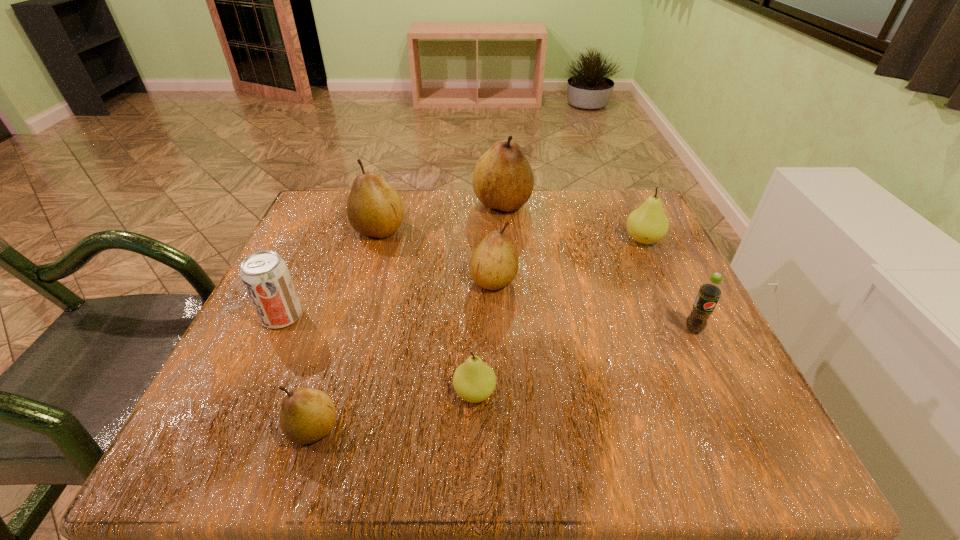
Find the location of a particular element. empty location between the tallest pear and the right green pear is located at coordinates (572, 222).

Where is `unoccupied position between the right soda and the left green pear`? Image resolution: width=960 pixels, height=540 pixels. unoccupied position between the right soda and the left green pear is located at coordinates (584, 361).

What are the coordinates of `vacant space in between the nearest brown pear and the second nearest brown pear` in the screenshot? It's located at (403, 354).

Image resolution: width=960 pixels, height=540 pixels. I want to click on the seventh closest object relative to the rightmost pear, so click(x=265, y=275).

Locate which object is the closest to the tallest object. Please provide its 2D coordinates. Your answer should be formatted as a tuple, i.e. [(x, y)], where the tuple contains the x and y coordinates of a point satisfying the conditions above.

[(374, 209)]

You are a GUI agent. You are given a task and a screenshot of the screen. Output one action in this format:
    pyautogui.click(x=<x>, y=<y>)
    Task: Click on the pear that is the second nearest to the left soda
    This screenshot has width=960, height=540.
    Given the screenshot: What is the action you would take?
    pyautogui.click(x=374, y=209)

Select which pear is the third closest to the left soda. Please provide its 2D coordinates. Your answer should be formatted as a tuple, i.e. [(x, y)], where the tuple contains the x and y coordinates of a point satisfying the conditions above.

[(474, 381)]

Find the location of `the fourth closest brown pear to the bigger green pear`. the fourth closest brown pear to the bigger green pear is located at coordinates (306, 415).

Choose which brown pear is the fourth nearest neighbor to the bigger green pear. Please provide its 2D coordinates. Your answer should be formatted as a tuple, i.e. [(x, y)], where the tuple contains the x and y coordinates of a point satisfying the conditions above.

[(306, 415)]

This screenshot has height=540, width=960. What are the coordinates of `vacant space that satisfies the following two spatial constraints: 1. on the back side of the second nearest brown pear; 2. on the left side of the left green pear` in the screenshot? It's located at (476, 280).